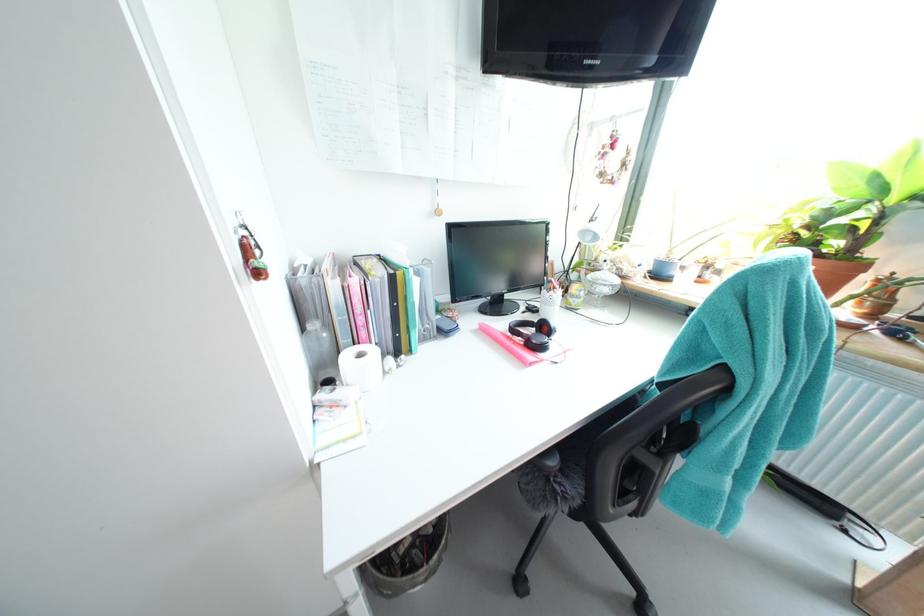
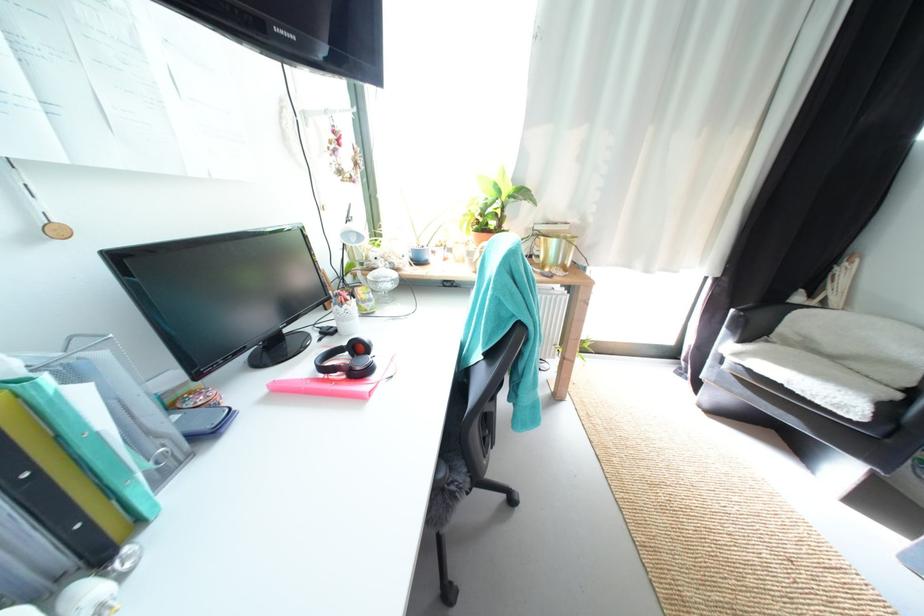
Where in the second image is the point corresponding to point 591,235 from the first image?

(354, 236)